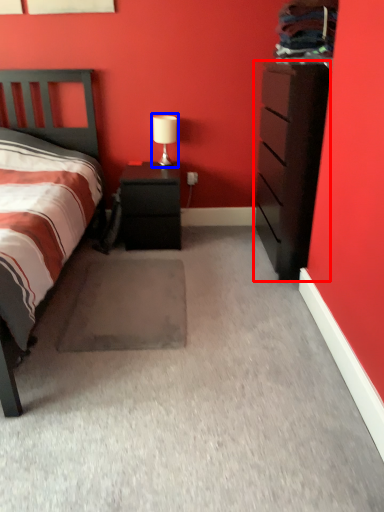
Question: Which object appears farthest to the camera in this image, chest of drawers (highlighted by a red box) or table lamp (highlighted by a blue box)?

Choices:
 (A) chest of drawers
 (B) table lamp

Answer: (B)